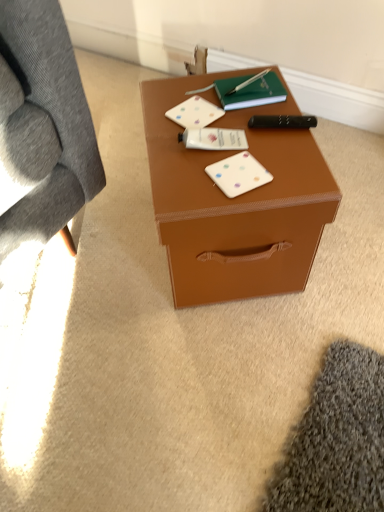
Find the location of a particular element. blank space to the left of white matte card game at center, which is counted as the 1th card game, starting from the top is located at coordinates (157, 117).